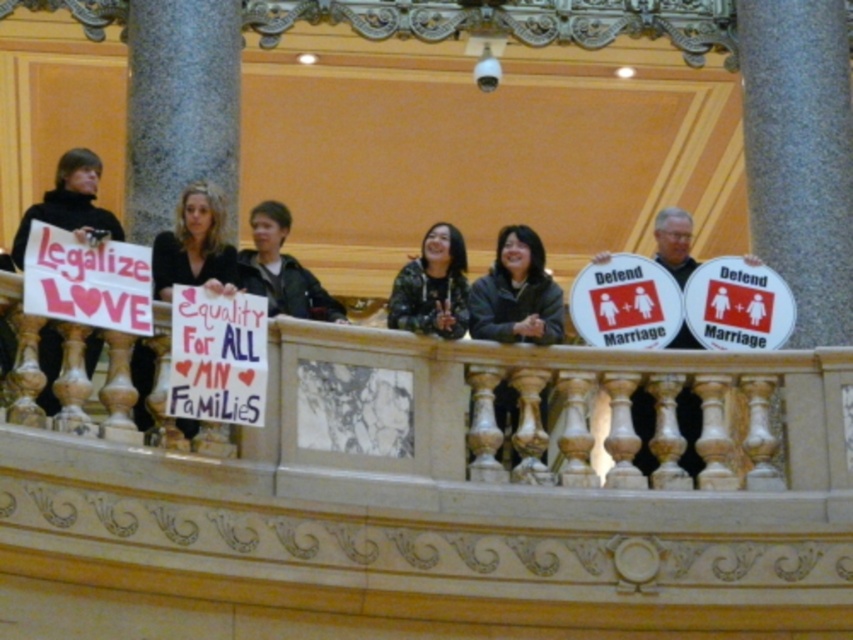
Question: Does matte black shirt at center have a lesser width compared to black matte sign at left?

Choices:
 (A) yes
 (B) no

Answer: (A)

Question: Among these objects, which one is nearest to the camera?

Choices:
 (A) camouflage jacket at center
 (B) dark gray jacket at center
 (C) matte black shirt at center

Answer: (C)

Question: Which point appears farthest from the camera in this image?

Choices:
 (A) tap(422, 248)
 (B) tap(74, 224)
 (C) tap(514, 234)
 (D) tap(189, 264)

Answer: (B)

Question: Based on their relative distances, which object is farther from the dark gray jacket at center?

Choices:
 (A) camouflage jacket at center
 (B) matte black shirt at center
 (C) black matte sign at left

Answer: (B)

Question: Is matte black shirt at center behind black matte sign at left?

Choices:
 (A) no
 (B) yes

Answer: (B)

Question: Can you confirm if dark gray jacket at center is wider than matte black shirt at center?

Choices:
 (A) yes
 (B) no

Answer: (A)